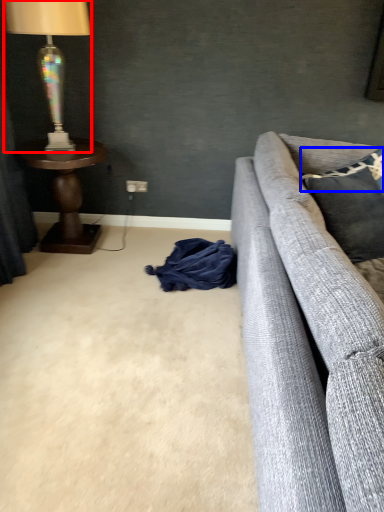
Question: Which point is further to the camera, lamp (highlighted by a red box) or pillow (highlighted by a blue box)?

Choices:
 (A) lamp
 (B) pillow

Answer: (B)